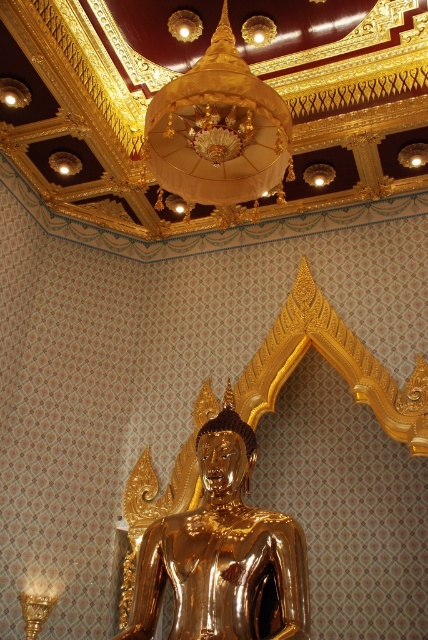
You are standing in the temple and want to light a candle. The gold silk chandelier at upper center is directly above the candle stand. Where should you place the candle relative to the gold metallic statue at center?

The candle should be placed to the right of the gold metallic statue at center because the gold silk chandelier at upper center is directly above the candle stand and the gold metallic statue at center is to the left of the chandelier.

You are an interior designer assessing the proportions of the temple. Given the height of the gold metallic statue at center and the gold silk chandelier at upper center, which object is shorter?

The gold metallic statue at center is shorter than the gold silk chandelier at upper center.